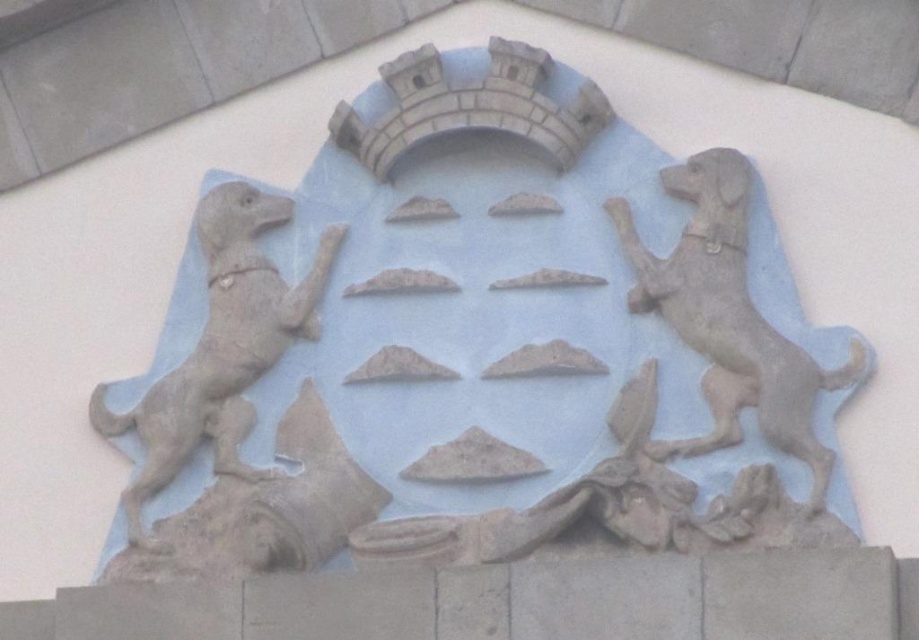
You are standing in front of the stone relief sculpture. You want to take a photo of the stone dogs at center. Considering your camera has a maximum focus range of 90 meters, will you be able to capture them clearly?

The stone dogs at center are 91.29 meters away from the camera. Since your camera can only focus up to 90 meters, you won t be able to capture them clearly.

You are an art conservator examining the stone relief sculpture. You need to inspect both gray stone dog at right and gray stone dog at left. Which dog should you examine first if you want to start with the one closer to you?

You should examine the gray stone dog at right first because it is closer to the viewer than the gray stone dog at left.

You are an art conservator assessing the stone relief sculpture. You notice two dogs in the design. Based on their sizes, which one would require more material for restoration? Please refer to the stone dogs at center and the gray stone dog at left in your answer.

The stone dogs at center require more material for restoration because they are larger in size than the gray stone dog at left.